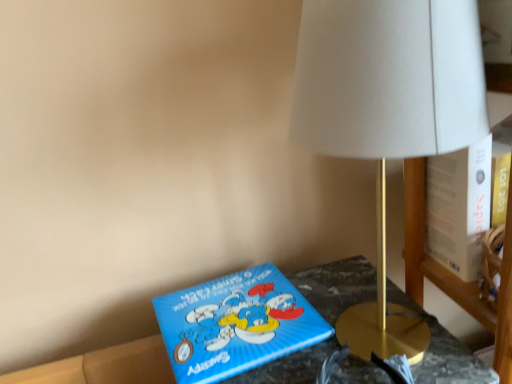
Identify the location of free space below gold metallic lamp at upper right (from a real-world perspective). The height and width of the screenshot is (384, 512). (381, 337).